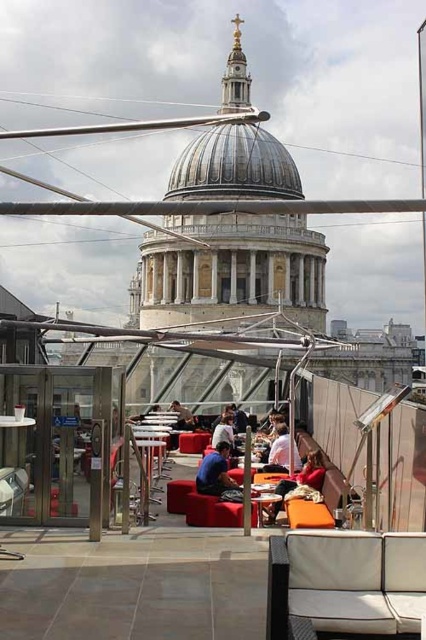
Which is above, wooden table at center or matte black jacket at center?

matte black jacket at center

Can you confirm if wooden table at center is positioned to the left of matte black jacket at center?

In fact, wooden table at center is to the right of matte black jacket at center.

Who is more distant from viewer, (261, 515) or (193, 420)?

Positioned behind is point (193, 420).

Where is `wooden table at center`? This screenshot has height=640, width=426. wooden table at center is located at coordinates (265, 500).

Based on the photo, does white fabric shirt at center appear on the right side of matte black jacket at center?

Yes, white fabric shirt at center is to the right of matte black jacket at center.

Is point (273, 452) farther from camera compared to point (189, 420)?

That is False.

Identify the location of white fabric shirt at center. Image resolution: width=426 pixels, height=640 pixels. (279, 448).

Who is more distant from viewer, [336,588] or [184,426]?

The point [184,426] is behind.

Describe the element at coordinates (345, 580) in the screenshot. Image resolution: width=426 pixels, height=640 pixels. I see `white fabric couch at center` at that location.

Describe the element at coordinates (345, 580) in the screenshot. I see `white fabric couch at center` at that location.

Locate an element on the screen. The image size is (426, 640). white fabric couch at center is located at coordinates (345, 580).